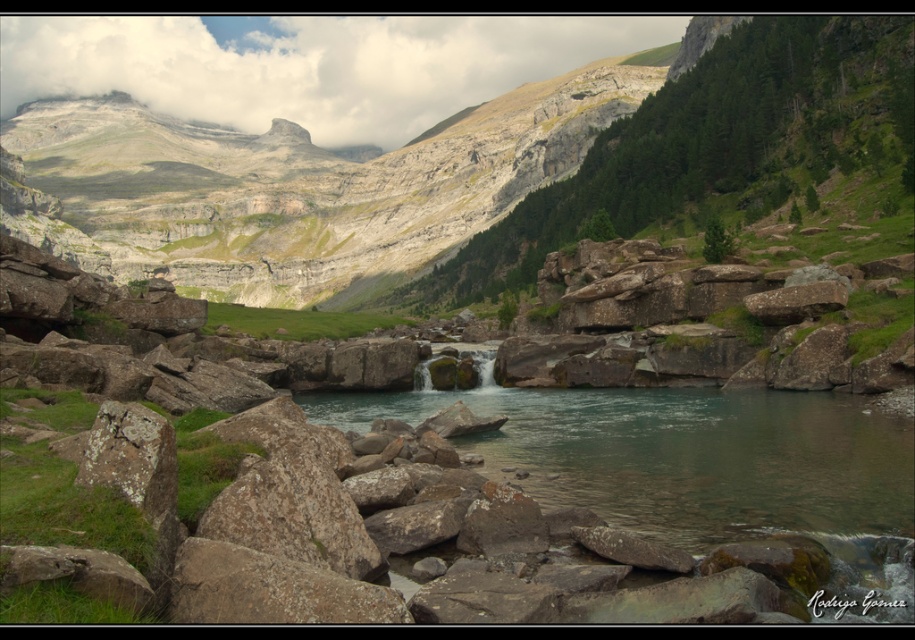
Which is behind, point (488, 150) or point (540, 442)?

The point (488, 150) is behind.

Does rugged stone mountain at center have a lesser height compared to clear water at center?

No, rugged stone mountain at center is not shorter than clear water at center.

You are a GUI agent. You are given a task and a screenshot of the screen. Output one action in this format:
    pyautogui.click(x=<x>, y=<y>)
    Task: Click on the rugged stone mountain at center
    The image size is (915, 640).
    Given the screenshot: What is the action you would take?
    pyautogui.click(x=293, y=188)